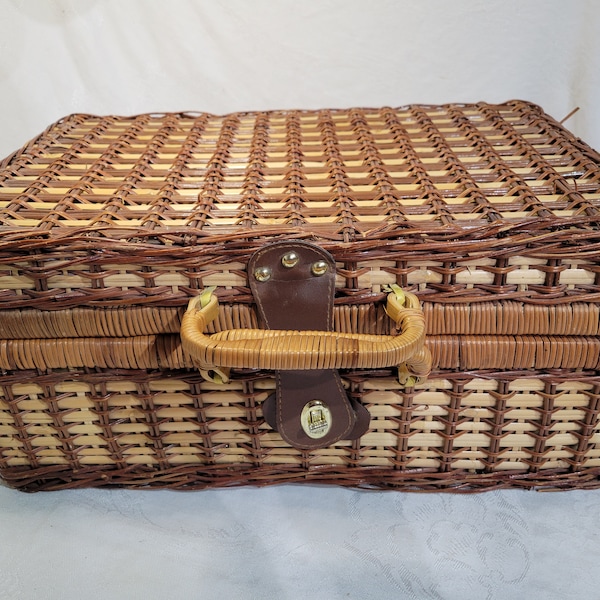
Where is `cloth that case is sitting on`? The height and width of the screenshot is (600, 600). cloth that case is sitting on is located at coordinates (459, 520).